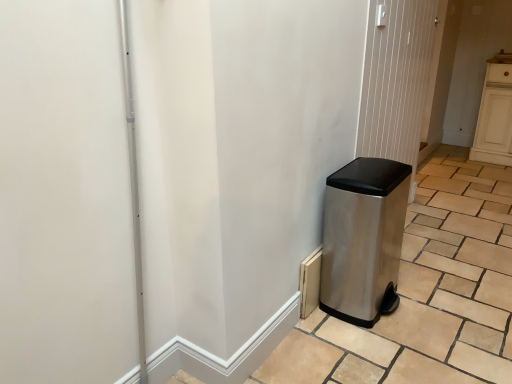
Question: Is stainless steel trash can at right taller than stainless steel trash can at right?

Choices:
 (A) no
 (B) yes

Answer: (B)

Question: Does stainless steel trash can at right have a smaller size compared to stainless steel trash can at right?

Choices:
 (A) yes
 (B) no

Answer: (A)

Question: Can you confirm if stainless steel trash can at right is shorter than stainless steel trash can at right?

Choices:
 (A) yes
 (B) no

Answer: (B)

Question: From a real-world perspective, is stainless steel trash can at right over stainless steel trash can at right?

Choices:
 (A) no
 (B) yes

Answer: (B)

Question: Is stainless steel trash can at right to the right of stainless steel trash can at right from the viewer's perspective?

Choices:
 (A) no
 (B) yes

Answer: (B)

Question: Is satin silver trash can at right spatially inside stainless steel trash can at right, or outside of it?

Choices:
 (A) inside
 (B) outside

Answer: (B)

Question: In terms of height, does satin silver trash can at right look taller or shorter compared to stainless steel trash can at right?

Choices:
 (A) tall
 (B) short

Answer: (B)

Question: From a real-world perspective, is satin silver trash can at right above or below stainless steel trash can at right?

Choices:
 (A) above
 (B) below

Answer: (B)

Question: Considering their positions, is satin silver trash can at right located in front of or behind stainless steel trash can at right?

Choices:
 (A) behind
 (B) front

Answer: (B)

Question: Is stainless steel trash can at right inside the boundaries of stainless steel trash can at right, or outside?

Choices:
 (A) outside
 (B) inside

Answer: (A)

Question: From a real-world perspective, is stainless steel trash can at right above or below stainless steel trash can at right?

Choices:
 (A) below
 (B) above

Answer: (A)

Question: Does point (369, 236) appear closer or farther from the camera than point (357, 139)?

Choices:
 (A) closer
 (B) farther

Answer: (A)

Question: Based on their sizes in the image, would you say stainless steel trash can at right is bigger or smaller than stainless steel trash can at right?

Choices:
 (A) small
 (B) big

Answer: (B)

Question: Would you say stainless steel trash can at right is to the left or to the right of satin silver trash can at right in the picture?

Choices:
 (A) right
 (B) left

Answer: (B)

Question: Based on their sizes in the image, would you say stainless steel trash can at right is bigger or smaller than satin silver trash can at right?

Choices:
 (A) big
 (B) small

Answer: (B)